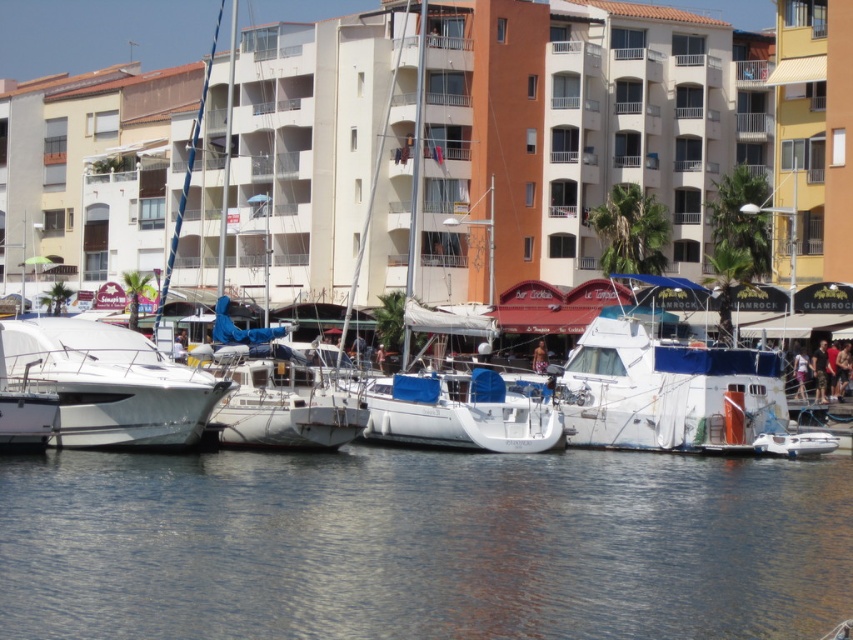
Question: Which point is closer to the camera?

Choices:
 (A) white matte sailboat at center
 (B) white smooth building at center

Answer: (A)

Question: Estimate the real-world distances between objects in this image. Which object is farther from the white matte boat at center?

Choices:
 (A) transparent water at lower center
 (B) white glossy boat at left
 (C) white smooth building at center

Answer: (C)

Question: Where is transparent water at lower center located in relation to white matte sailboat at center in the image?

Choices:
 (A) above
 (B) below

Answer: (B)

Question: Does transparent water at lower center appear under white glossy boat at left?

Choices:
 (A) yes
 (B) no

Answer: (A)

Question: Which point is closer to the camera taking this photo?

Choices:
 (A) (747, 96)
 (B) (84, 435)
 (C) (583, 413)

Answer: (B)

Question: Does transparent water at lower center appear under white matte sailboat at center?

Choices:
 (A) yes
 (B) no

Answer: (A)